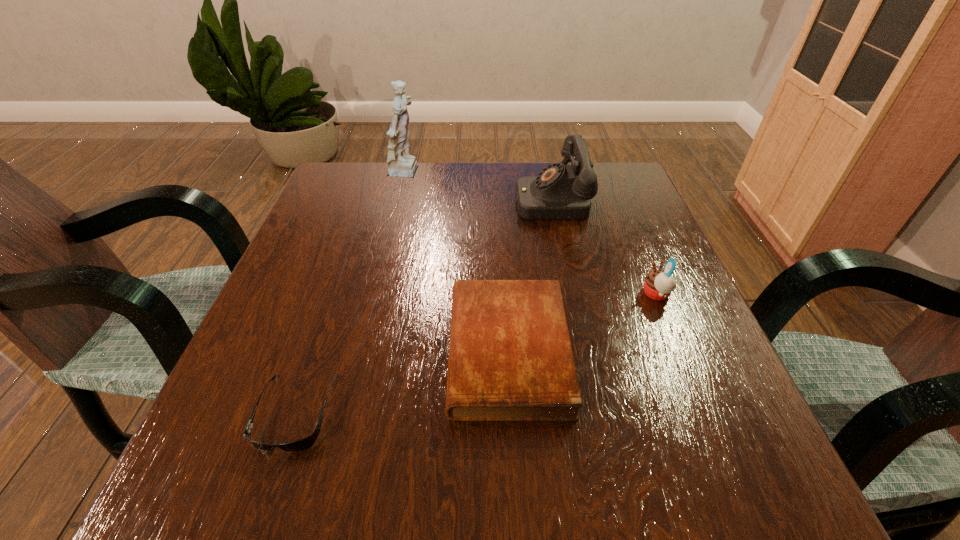
Locate an element on the screen. The image size is (960, 540). figurine is located at coordinates (401, 164).

Identify the location of the second tallest object. This screenshot has height=540, width=960. (560, 192).

The image size is (960, 540). Identify the location of the rightmost object. (658, 284).

The width and height of the screenshot is (960, 540). Identify the location of muffin. (658, 284).

The image size is (960, 540). Identify the location of Bible. coord(510,357).

The height and width of the screenshot is (540, 960). Find the location of `sunglasses`. sunglasses is located at coordinates (305, 443).

Image resolution: width=960 pixels, height=540 pixels. I want to click on vacant region located on the front-facing side of the tallest object, so click(x=461, y=174).

You are a GUI agent. You are given a task and a screenshot of the screen. Output one action in this format:
    pyautogui.click(x=<x>, y=<y>)
    Task: Click on the free space located 0.060m on the dial of the telephone
    
    Given the screenshot: What is the action you would take?
    pyautogui.click(x=491, y=199)

The width and height of the screenshot is (960, 540). What are the coordinates of `vacant space located 0.110m on the dial of the telephone` in the screenshot? It's located at (470, 199).

I want to click on free spot located 0.220m on the dial of the telephone, so click(424, 199).